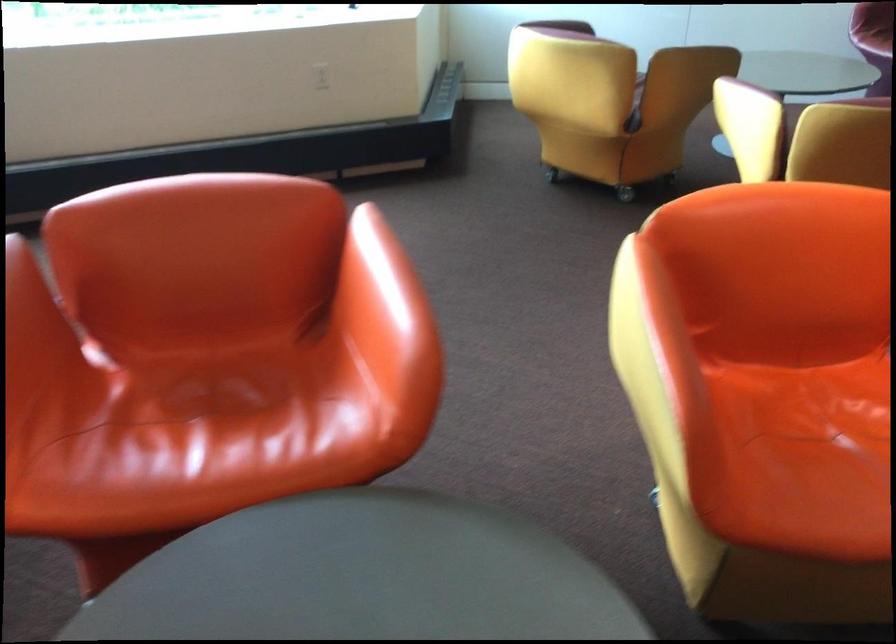
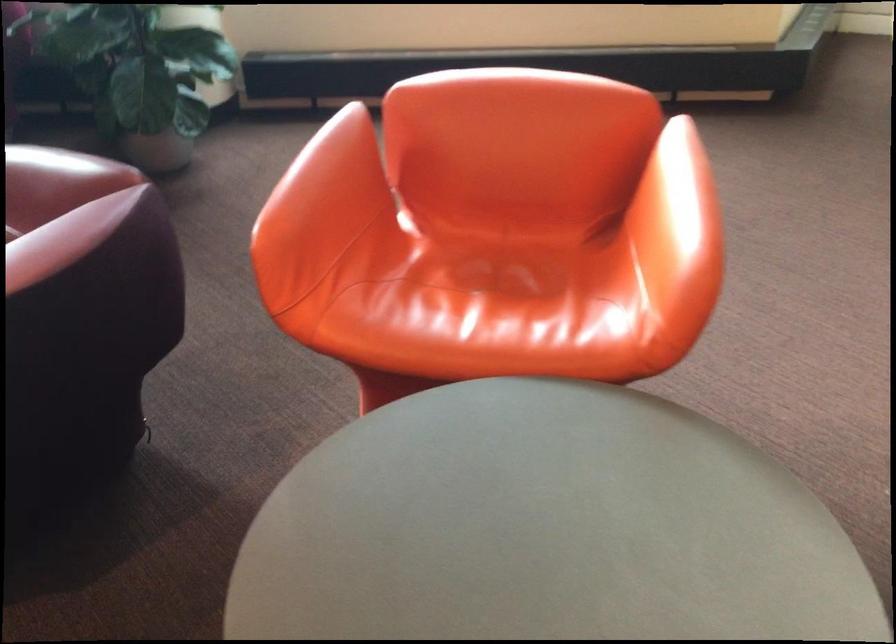
In the second image, find the point that corresponds to [203,384] in the first image.

(487, 261)